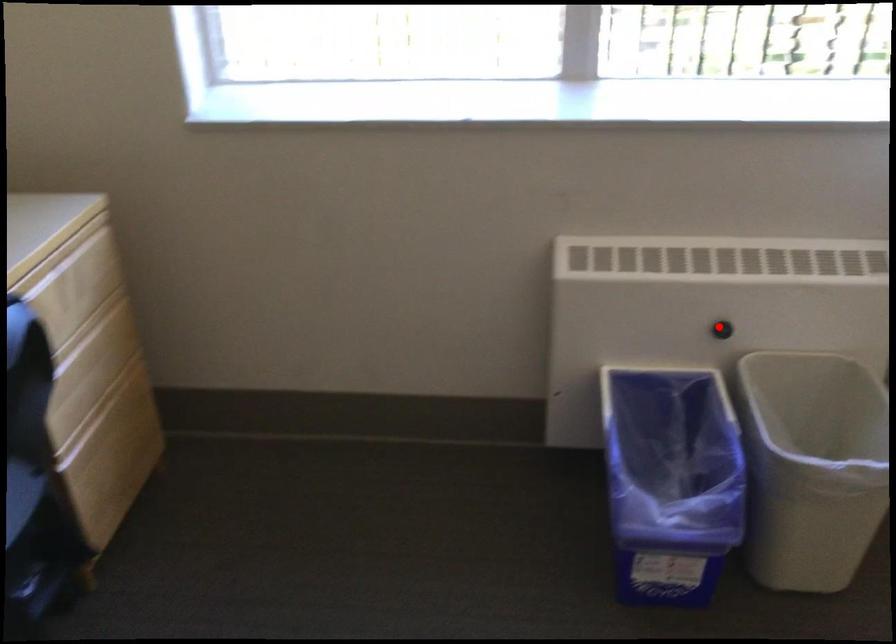
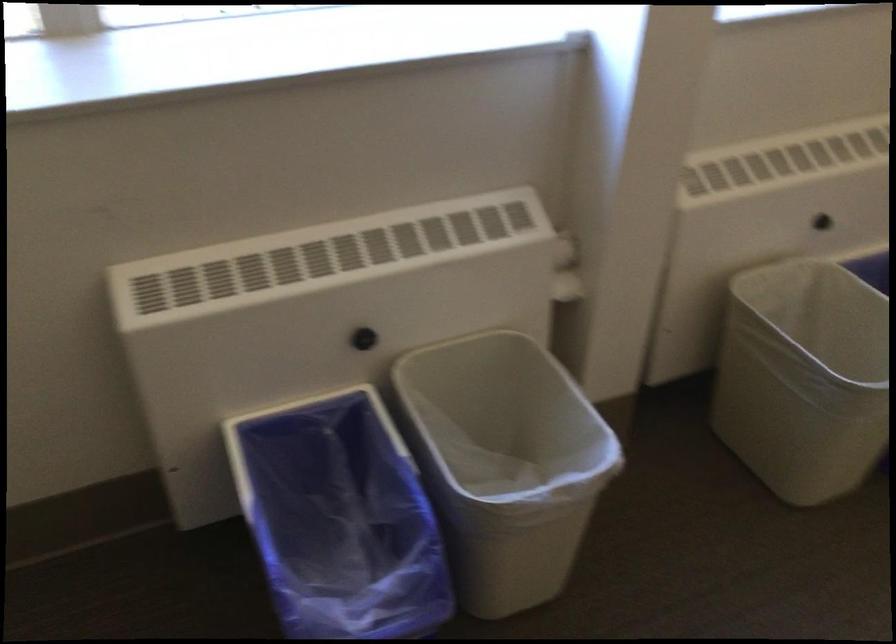
Locate, in the second image, the point that corresponds to the highlighted location in the first image.

(364, 339)